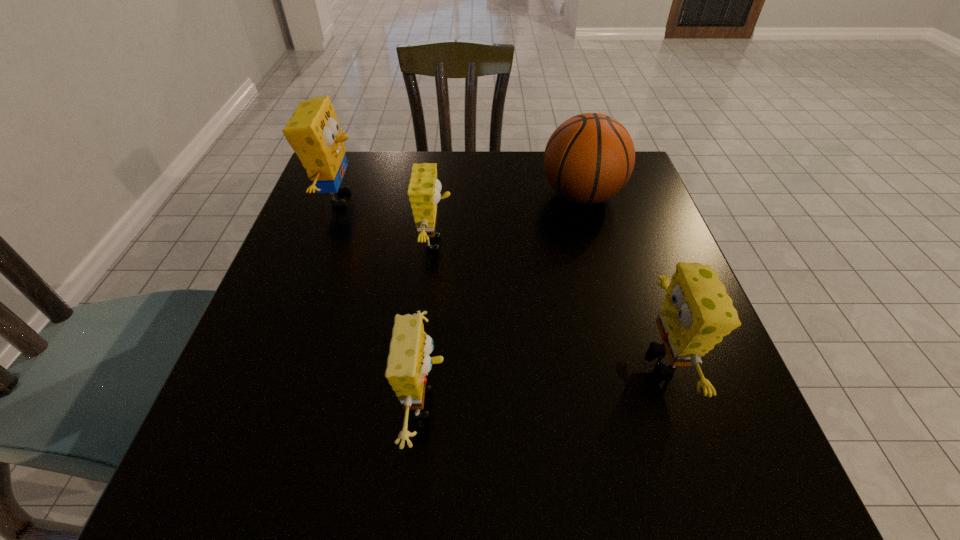
In order to click on free space at the right edge in this screenshot , I will do `click(745, 418)`.

This screenshot has width=960, height=540. I want to click on free point at the far left corner, so click(352, 153).

Locate an element on the screen. The image size is (960, 540). free region at the near left corner of the desktop is located at coordinates (218, 455).

The height and width of the screenshot is (540, 960). I want to click on free space between the basketball and the leftmost sponge, so click(x=461, y=197).

You are a GUI agent. You are given a task and a screenshot of the screen. Output one action in this format:
    pyautogui.click(x=<x>, y=<y>)
    Task: Click on the empty location between the leftmost sponge and the rightmost sponge
    The height and width of the screenshot is (540, 960).
    Given the screenshot: What is the action you would take?
    pyautogui.click(x=501, y=279)

Where is `free space that is in between the leftmost sponge and the rightmost sponge`? This screenshot has width=960, height=540. free space that is in between the leftmost sponge and the rightmost sponge is located at coordinates (501, 279).

Locate an element on the screen. Image resolution: width=960 pixels, height=540 pixels. empty space that is in between the rightmost sponge and the basketball is located at coordinates (623, 277).

This screenshot has height=540, width=960. I want to click on empty location between the rightmost sponge and the leftmost object, so click(x=501, y=279).

Find the location of a particular element. This screenshot has height=540, width=960. object that is the closest to the rightmost sponge is located at coordinates tap(589, 158).

Choose which object is the third nearest neighbor to the rightmost sponge. Please provide its 2D coordinates. Your answer should be formatted as a tuple, i.e. [(x, y)], where the tuple contains the x and y coordinates of a point satisfying the conditions above.

[(424, 189)]